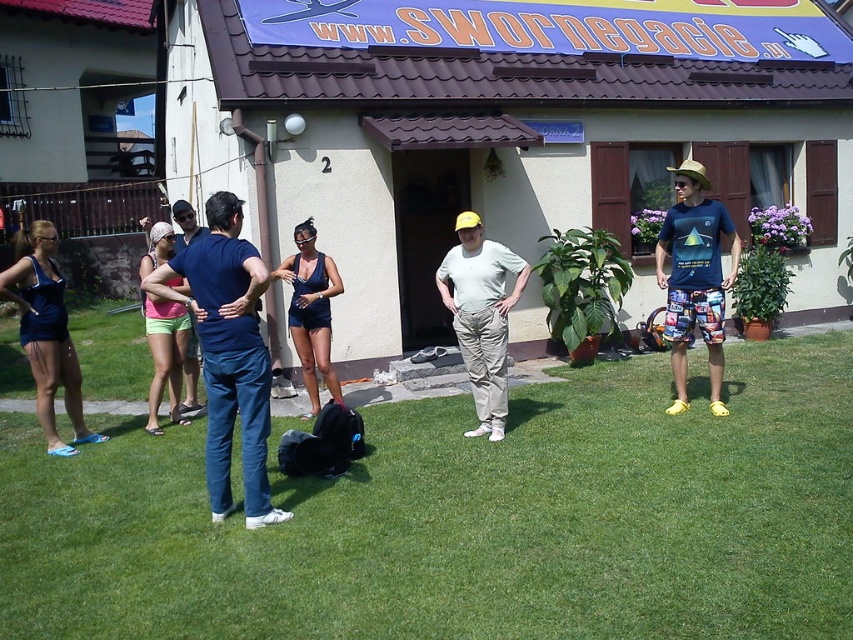
Question: Can you confirm if light gray cotton pants at center is thinner than matte blue shirt at center?

Choices:
 (A) no
 (B) yes

Answer: (A)

Question: Among these points, which one is nearest to the camera?

Choices:
 (A) (322, 307)
 (B) (689, 241)

Answer: (B)

Question: Which point is closer to the camera?

Choices:
 (A) (215, 481)
 (B) (189, 212)

Answer: (A)

Question: Which object is the farthest from the matte blue shirt at center?

Choices:
 (A) matte blue swimsuit at center
 (B) matte blue swimsuit at left
 (C) green grass at center

Answer: (C)

Question: Is matte blue swimsuit at left above matte blue swimsuit at center?

Choices:
 (A) no
 (B) yes

Answer: (A)

Question: Does matte blue swimsuit at center have a lesser width compared to pink fabric shorts at center?

Choices:
 (A) no
 (B) yes

Answer: (B)